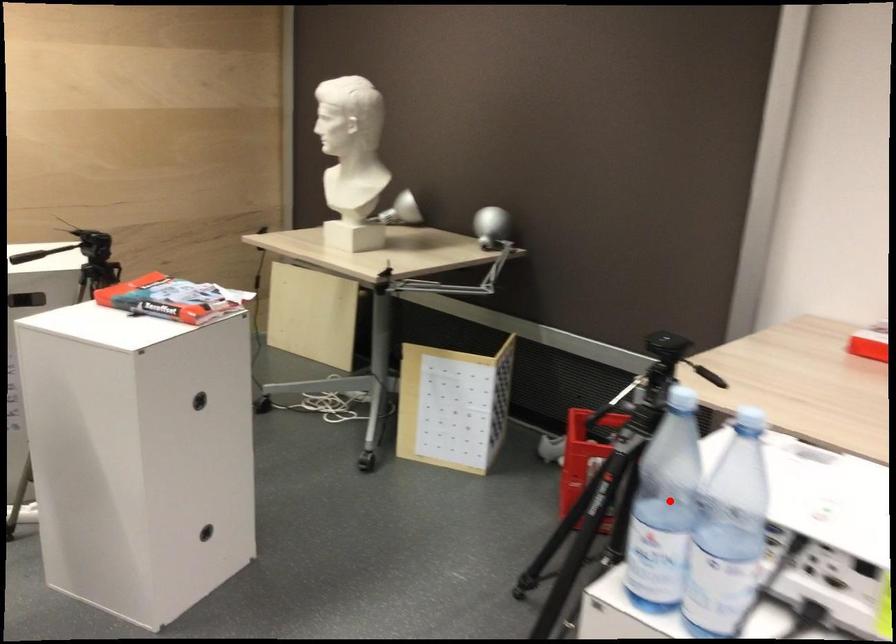
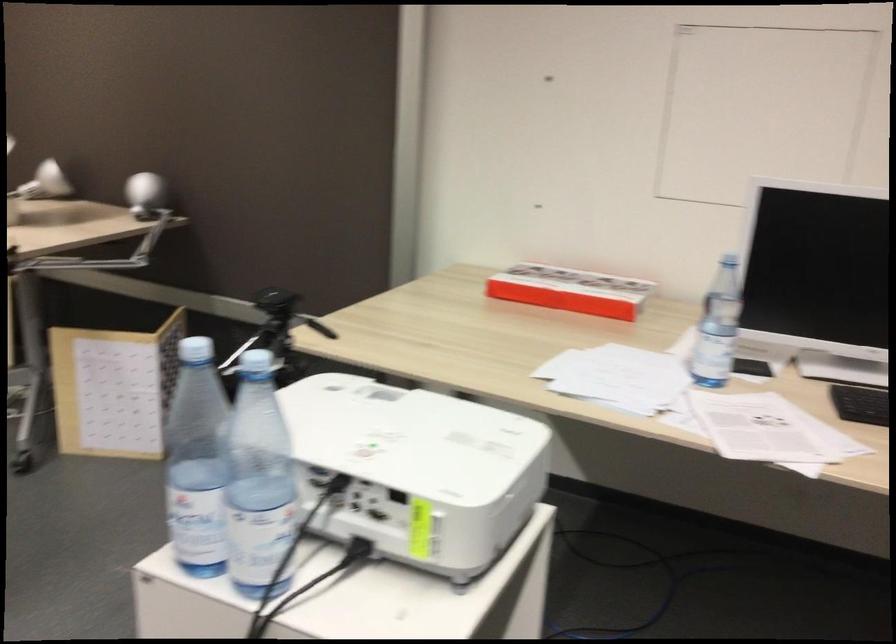
Where in the second image is the point corresponding to the highlighted location from the first image?

(195, 462)